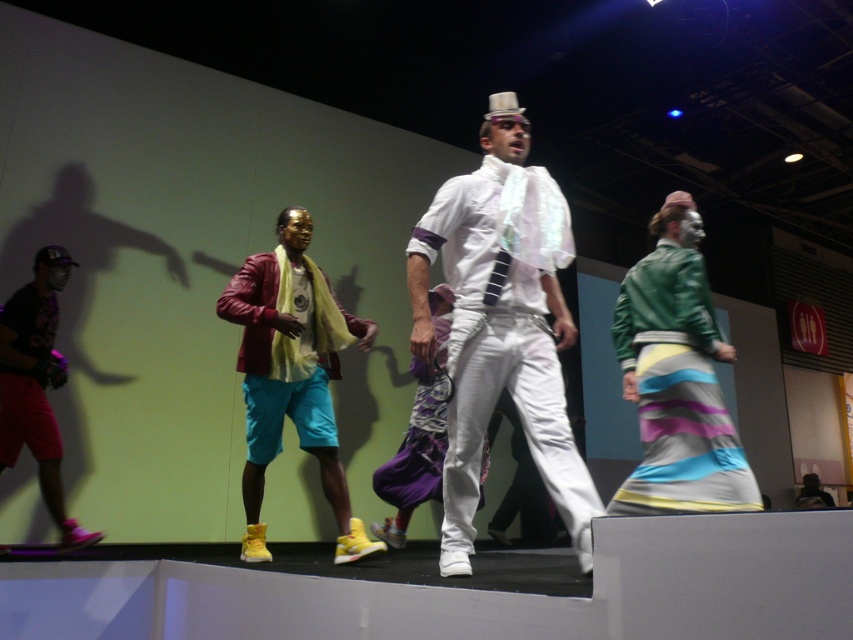
You are a photographer setting up a camera on the stage. You need to ensure that the matte leather jacket at center and the brushed metal baseball cap at left are both in focus. Given their height difference, which object should you adjust your camera focus on first to ensure both are sharp?

The matte leather jacket at center is taller than the brushed metal baseball cap at left. To ensure both are in focus, you should focus on the matte leather jacket at center first, as it is the taller object, and then adjust the focus to include the shorter brushed metal baseball cap at left.

You are a stagehand setting up a spotlight for the performance. The spotlight needs to be positioned directly above the matte leather jacket at center. According to the coordinates provided, where should you aim the spotlight?

The matte leather jacket at center is located at point (292, 374), so the spotlight should be aimed at those coordinates to illuminate it directly.